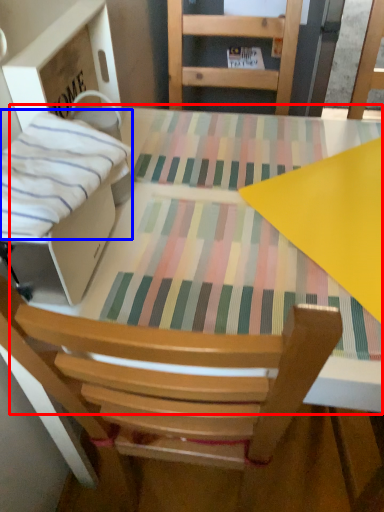
Question: Which object appears closest to the camera in this image, round table (highlighted by a red box) or blanket (highlighted by a blue box)?

Choices:
 (A) round table
 (B) blanket

Answer: (B)